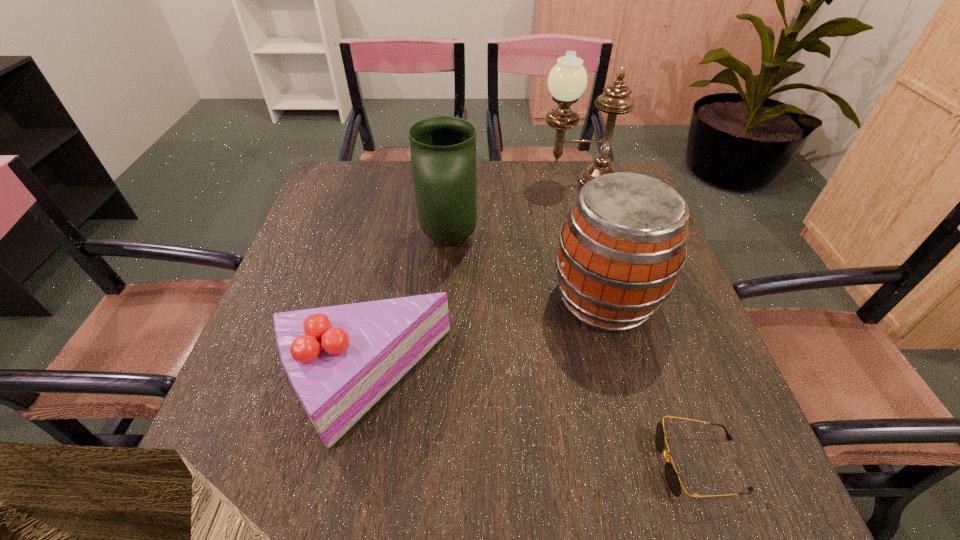
Locate an element on the screen. This screenshot has width=960, height=540. the farthest object is located at coordinates (567, 80).

Where is `the tallest object`? This screenshot has width=960, height=540. the tallest object is located at coordinates (567, 80).

Where is `vase`? The width and height of the screenshot is (960, 540). vase is located at coordinates (443, 149).

You are a GUI agent. You are given a task and a screenshot of the screen. Output one action in this format:
    pyautogui.click(x=<x>, y=<y>)
    Task: Click on the cider
    The width and height of the screenshot is (960, 540).
    Given the screenshot: What is the action you would take?
    pyautogui.click(x=623, y=244)

Where is `cake`? cake is located at coordinates (340, 360).

I want to click on the shortest object, so click(672, 477).

You are a GUI agent. You are given a task and a screenshot of the screen. Output one action in this format:
    pyautogui.click(x=<x>, y=<y>)
    Task: Click on the free space located on the left of the farthest object
    This screenshot has width=960, height=540.
    Given the screenshot: What is the action you would take?
    tap(464, 181)

Where is `free region located on the right of the vase`? free region located on the right of the vase is located at coordinates (540, 238).

Identify the location of free space located on the left of the cider. (402, 300).

The height and width of the screenshot is (540, 960). I want to click on vacant area situated 0.340m on the right of the fourth tallest object, so [x=627, y=383].